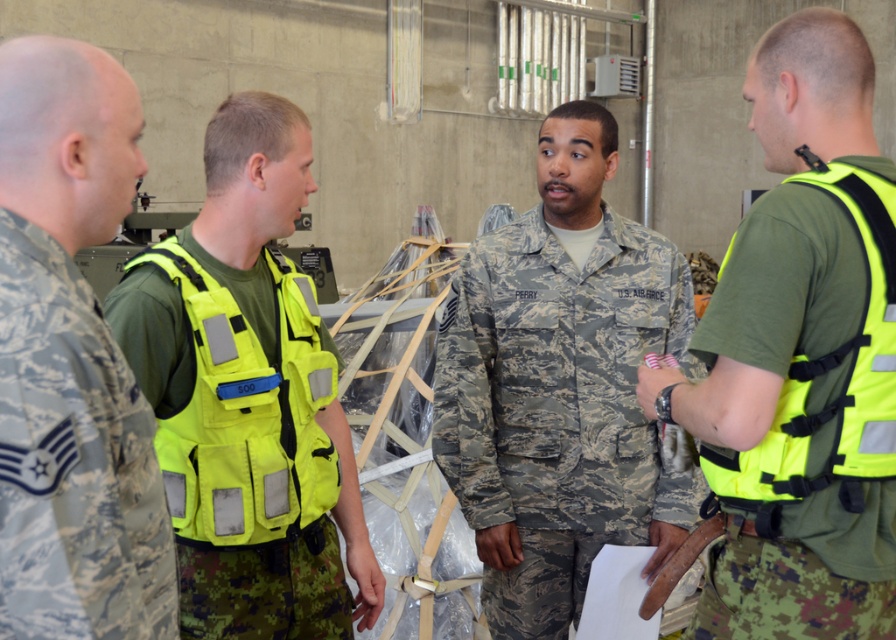
Question: Which of the following is the closest to the observer?

Choices:
 (A) (240, 509)
 (B) (140, 554)
 (C) (776, 42)

Answer: (B)

Question: Which object appears closest to the camera in this image?

Choices:
 (A) camouflage uniform at center
 (B) neon yellow fabric safety vest at center
 (C) neon yellow vest at center
 (D) neon yellow vest at right

Answer: (D)

Question: Is neon yellow vest at center in front of neon yellow fabric safety vest at center?

Choices:
 (A) yes
 (B) no

Answer: (A)

Question: Is neon yellow vest at center in front of neon yellow reflective vest at right?

Choices:
 (A) yes
 (B) no

Answer: (B)

Question: Which point is closer to the camera taking this photo?

Choices:
 (A) (772, 225)
 (B) (729, 381)
 (C) (679, 353)

Answer: (A)

Question: Is neon yellow vest at center positioned before neon yellow reflective vest at right?

Choices:
 (A) yes
 (B) no

Answer: (B)